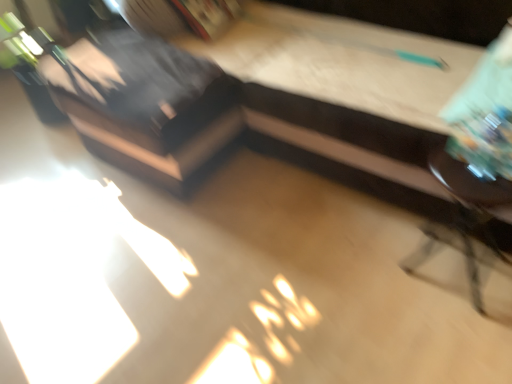
Question: Should I look upward or downward to see metallic dark brown swivel chair at right?

Choices:
 (A) down
 (B) up

Answer: (A)